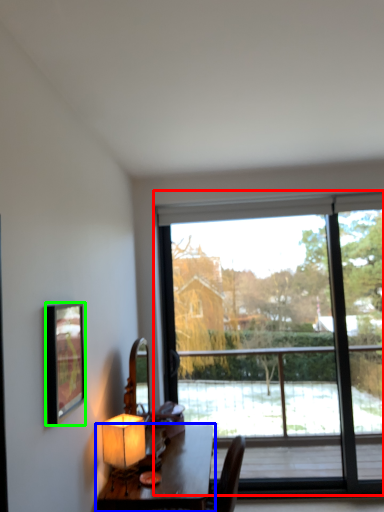
Question: Estimate the real-world distances between objects in this image. Which object is closer to window (highlighted by a red box), table (highlighted by a blue box) or picture frame (highlighted by a green box)?

Choices:
 (A) table
 (B) picture frame

Answer: (A)